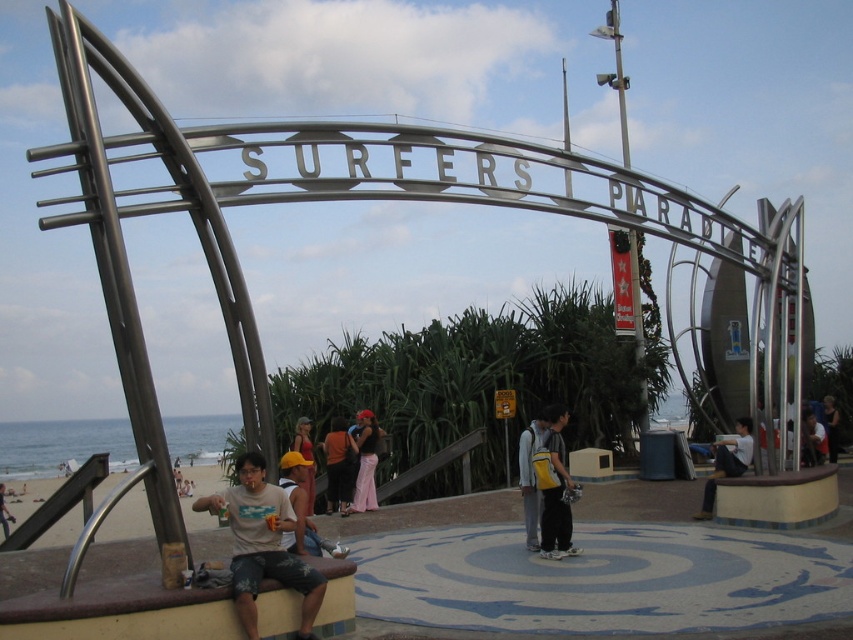
Does white shirt at center have a greater height compared to matte gray surfboard at lower left?

Correct, white shirt at center is much taller as matte gray surfboard at lower left.

Is point (708, 481) closer to camera compared to point (13, 522)?

Yes, it is.

Locate an element on the screen. This screenshot has height=640, width=853. white shirt at center is located at coordinates (727, 461).

Can you confirm if matte white t-shirt at center is positioned to the right of matte gray surfboard at lower left?

Correct, you'll find matte white t-shirt at center to the right of matte gray surfboard at lower left.

Is point (270, 572) farther from viewer compared to point (1, 492)?

That is False.

The width and height of the screenshot is (853, 640). Find the location of `matte white t-shirt at center`. matte white t-shirt at center is located at coordinates (263, 545).

Is matte white t-shirt at center positioned in front of matte yellow hat at center?

Yes, it is.

Where is `matte white t-shirt at center`? This screenshot has width=853, height=640. matte white t-shirt at center is located at coordinates (263, 545).

Which is behind, point (254, 566) or point (306, 493)?

The point (306, 493) is more distant.

Locate an element on the screen. matte white t-shirt at center is located at coordinates (263, 545).